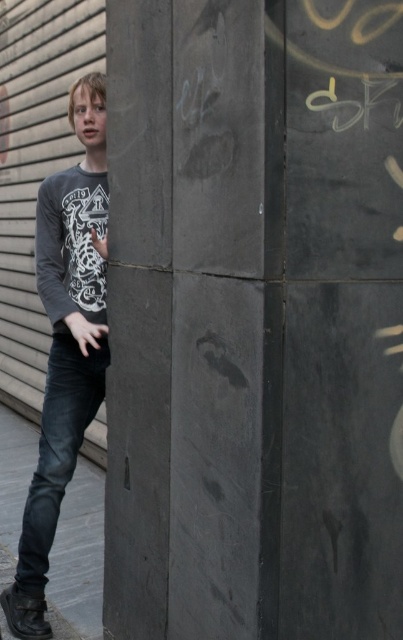
Describe the element at coordinates (66, 342) in the screenshot. This screenshot has height=640, width=403. I see `dark gray cotton shirt at left` at that location.

Does dark gray cotton shirt at left have a larger size compared to black denim jeans at lower left?

Yes, dark gray cotton shirt at left is bigger than black denim jeans at lower left.

Which is behind, point (103, 259) or point (33, 529)?

The point (33, 529) is behind.

The height and width of the screenshot is (640, 403). In order to click on dark gray cotton shirt at left in this screenshot , I will do `click(66, 342)`.